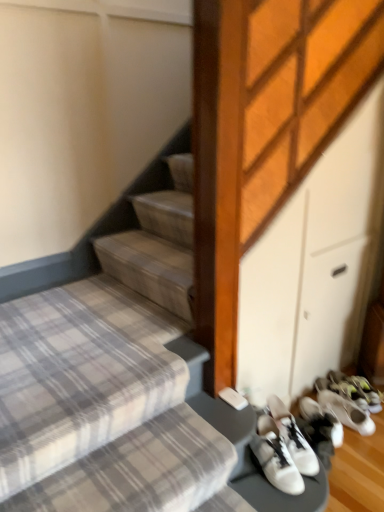
Question: From the image's perspective, relative to plaid fabric stairs at lower left, is white matte sneakers at lower right, arranged as the second footwear when viewed from the front, above or below?

Choices:
 (A) above
 (B) below

Answer: (B)

Question: Looking at their shapes, would you say white matte sneakers at lower right, which is counted as the 1th footwear, starting from the back, is wider or thinner than plaid fabric stairs at lower left?

Choices:
 (A) wide
 (B) thin

Answer: (B)

Question: Estimate the real-world distances between objects in this image. Which object is farther from the white leather sneakers at lower right, positioned as the 2th footwear in right-to-left order?

Choices:
 (A) white matte sneakers at lower right, which is counted as the 1th footwear, starting from the back
 (B) plaid fabric stairs at lower left

Answer: (B)

Question: Estimate the real-world distances between objects in this image. Which object is closer to the plaid fabric stairs at lower left?

Choices:
 (A) white matte sneakers at lower right, arranged as the second footwear when viewed from the front
 (B) white leather sneakers at lower right, the second footwear viewed from the back

Answer: (B)